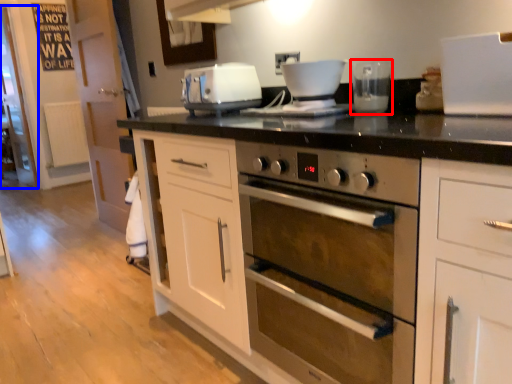
Question: Among these objects, which one is nearest to the camera, coffee machine (highlighted by a red box) or glass door (highlighted by a blue box)?

Choices:
 (A) coffee machine
 (B) glass door

Answer: (A)